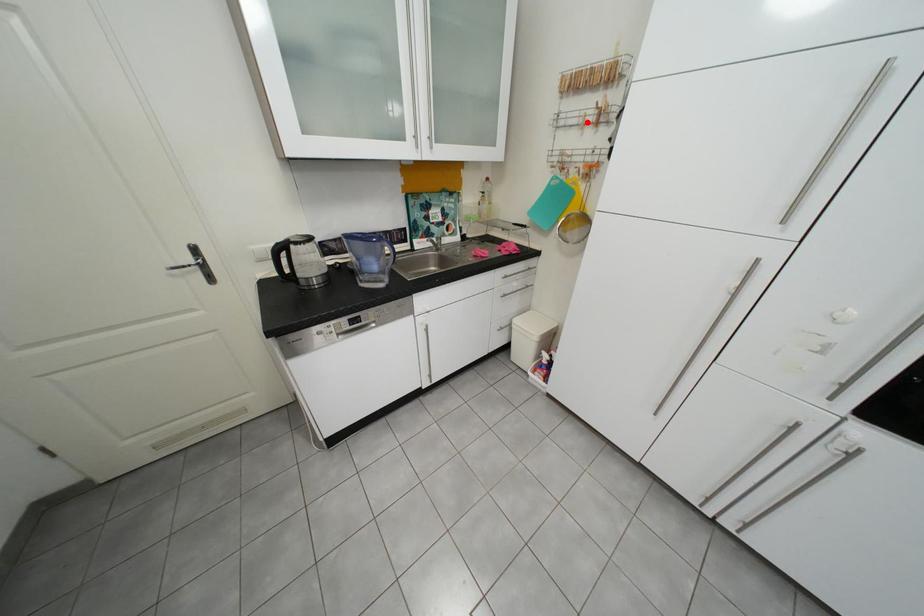
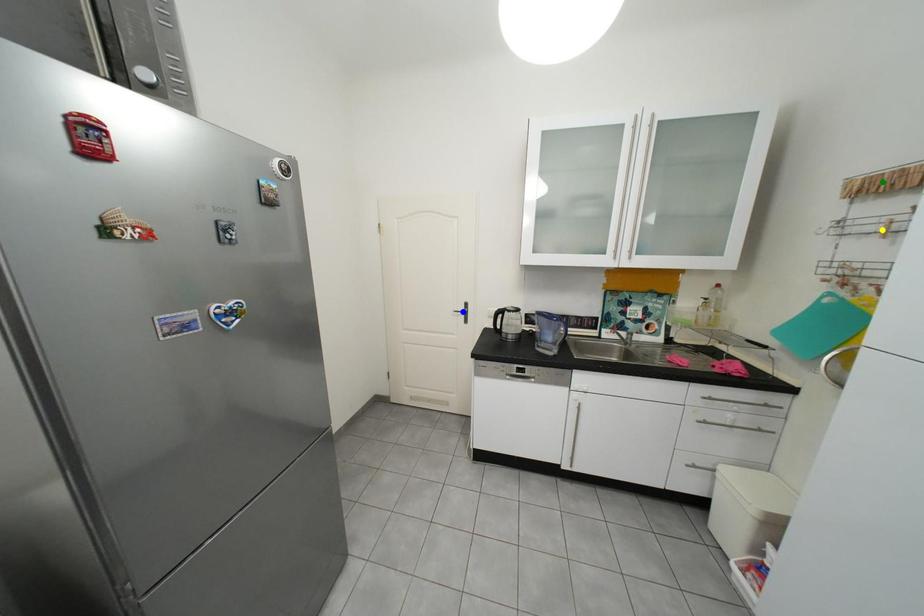
Question: I am providing you with two images of the same scene from different viewpoints. A red point is marked on the first image. You are given multiple points on the second image. Which point in image 2 is actually the same real-world point as the red point in image 1?

Choices:
 (A) green point
 (B) blue point
 (C) yellow point

Answer: (C)